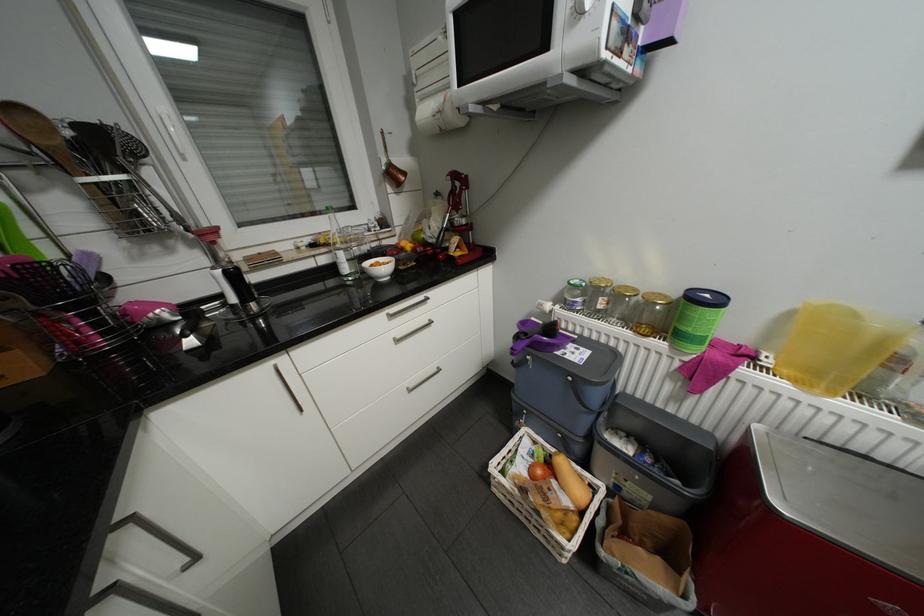
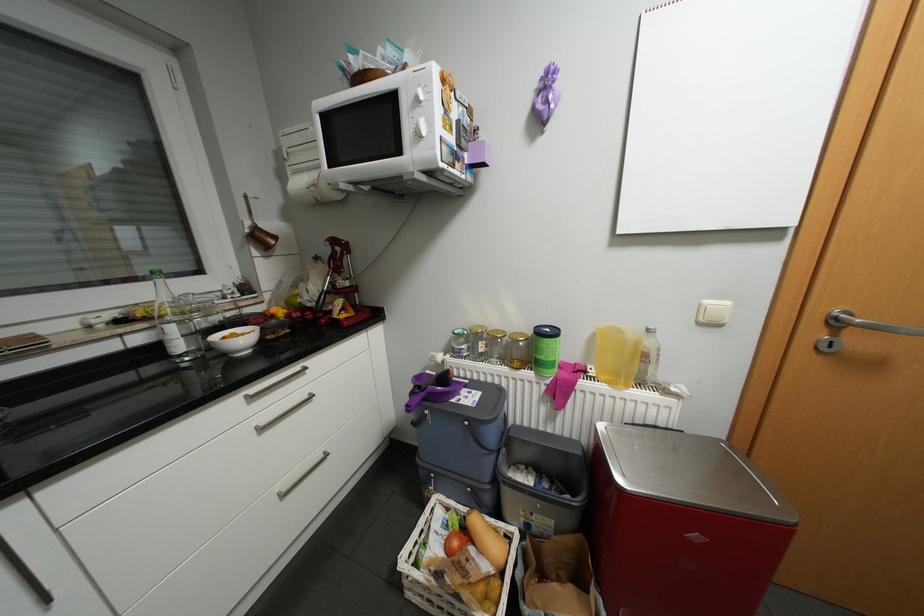
The point at (x=402, y=338) is marked in the first image. Where is the corresponding point in the second image?

(264, 427)